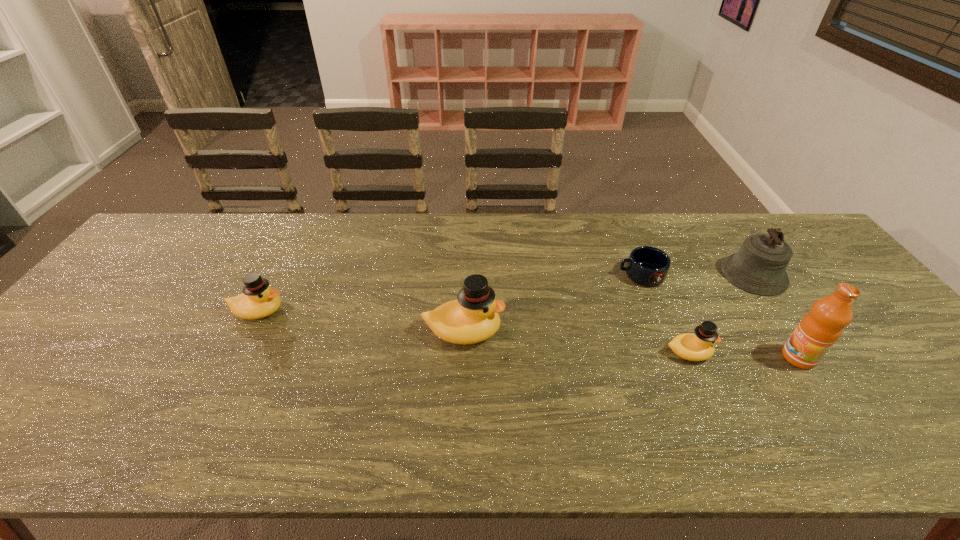
This screenshot has width=960, height=540. What are the coordinates of `free space between the tallest duck and the leftmost duck` in the screenshot? It's located at (361, 321).

Where is `free space between the bell and the rightmost duck`? free space between the bell and the rightmost duck is located at coordinates (721, 314).

The width and height of the screenshot is (960, 540). Identify the location of vacant space that is in between the tallest duck and the mug. (552, 303).

Where is `vacant region between the bell and the tallest duck`? vacant region between the bell and the tallest duck is located at coordinates (609, 303).

Select which object is the fifth closest to the mug. Please provide its 2D coordinates. Your answer should be formatted as a tuple, i.e. [(x, y)], where the tuple contains the x and y coordinates of a point satisfying the conditions above.

[(258, 300)]

This screenshot has height=540, width=960. I want to click on object that ranks as the third closest to the leftmost duck, so click(694, 347).

Locate which duck ranks in proximity to the tallest duck. Please provide its 2D coordinates. Your answer should be formatted as a tuple, i.e. [(x, y)], where the tuple contains the x and y coordinates of a point satisfying the conditions above.

[(258, 300)]

Select which duck appears as the second closest to the second object from left to right. Please provide its 2D coordinates. Your answer should be formatted as a tuple, i.e. [(x, y)], where the tuple contains the x and y coordinates of a point satisfying the conditions above.

[(694, 347)]

Locate an element on the screen. Image resolution: width=960 pixels, height=540 pixels. vacant space that satisfies the following two spatial constraints: 1. on the front side of the bell; 2. on the label side of the tallest object is located at coordinates (811, 357).